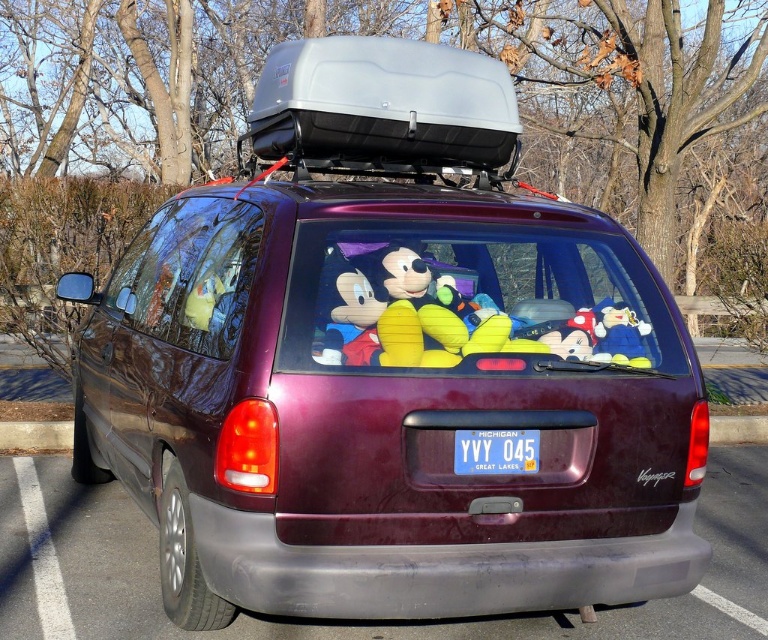
In the scene shown: Between gray plastic cargo box at center and blue plastic license plate at center, which one has more height?

gray plastic cargo box at center is taller.

Can you confirm if gray plastic cargo box at center is positioned above blue plastic license plate at center?

Indeed, gray plastic cargo box at center is positioned over blue plastic license plate at center.

Identify the location of gray plastic cargo box at center. (382, 108).

Between maroon metallic van at center and blue plastic license plate at center, which one appears on the right side from the viewer's perspective?

From the viewer's perspective, blue plastic license plate at center appears more on the right side.

Is maroon metallic van at center positioned behind blue plastic license plate at center?

No.

Measure the distance between maroon metallic van at center and camera.

A distance of 9.39 feet exists between maroon metallic van at center and camera.

Where is `maroon metallic van at center`? maroon metallic van at center is located at coordinates (391, 403).

Which of these two, maroon metallic van at center or gray plastic cargo box at center, stands taller?

maroon metallic van at center is taller.

At what (x,y) coordinates should I click in order to perform the action: click on maroon metallic van at center. Please return your answer as a coordinate pair (x, y). The height and width of the screenshot is (640, 768). Looking at the image, I should click on (391, 403).